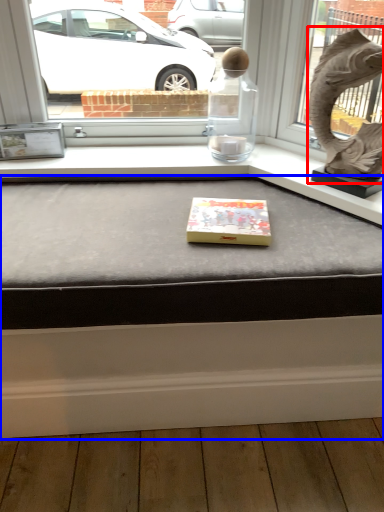
Question: Which point is further to the camera, animal sculpture (highlighted by a red box) or table (highlighted by a blue box)?

Choices:
 (A) animal sculpture
 (B) table

Answer: (A)